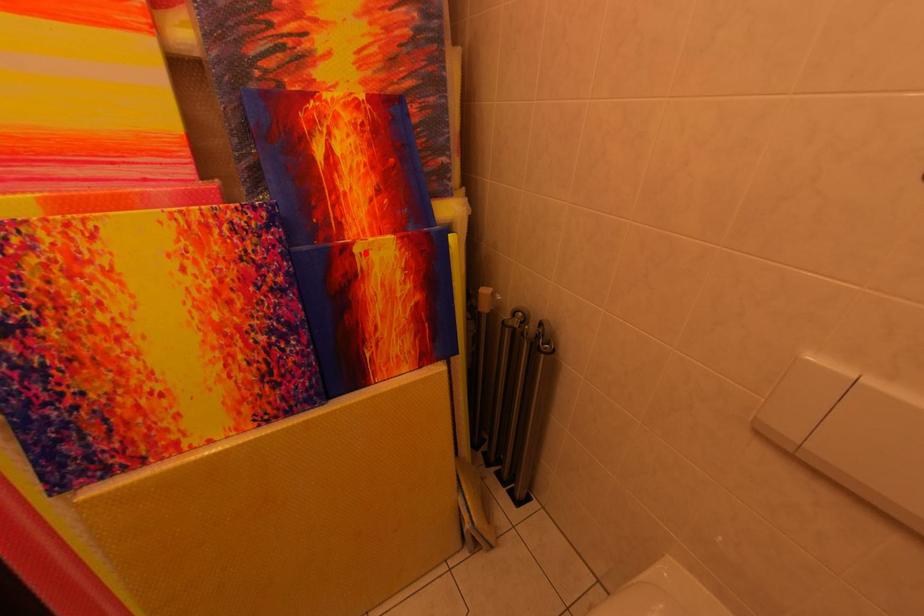
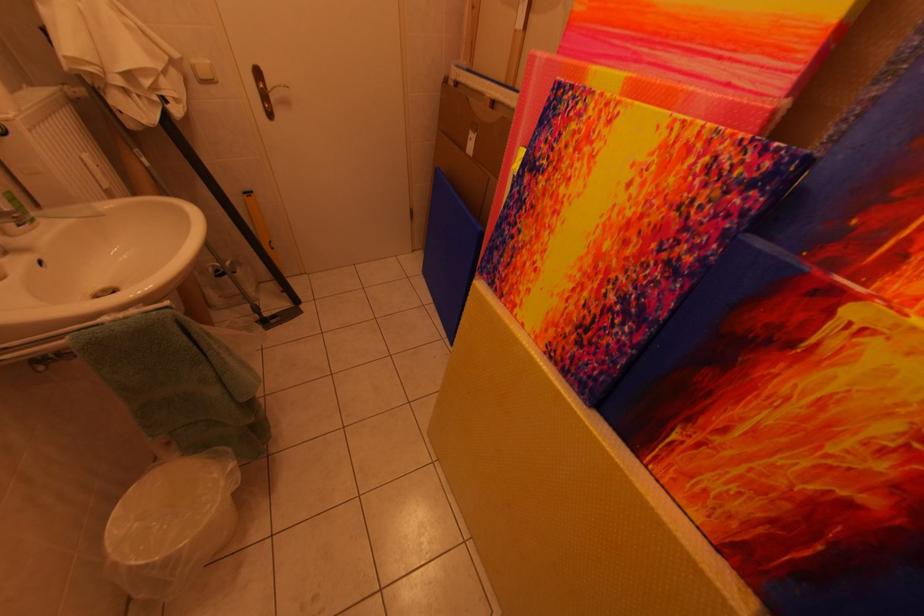
Where in the second image is the point corresponding to the highlighted location from the first image?

(861, 317)